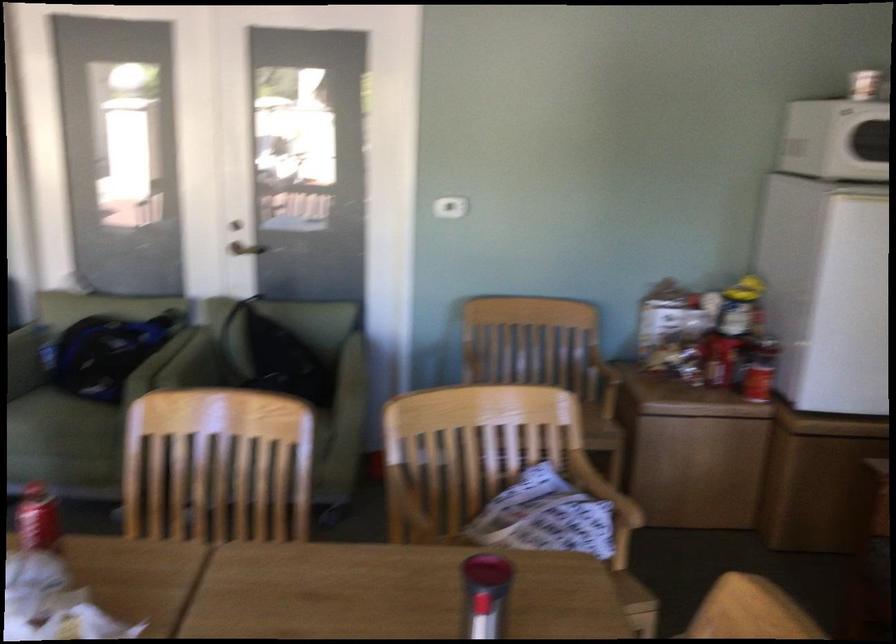
Find the location of a particular element. Image resolution: width=896 pixels, height=644 pixels. wooden chair sitting surface is located at coordinates (217, 466).